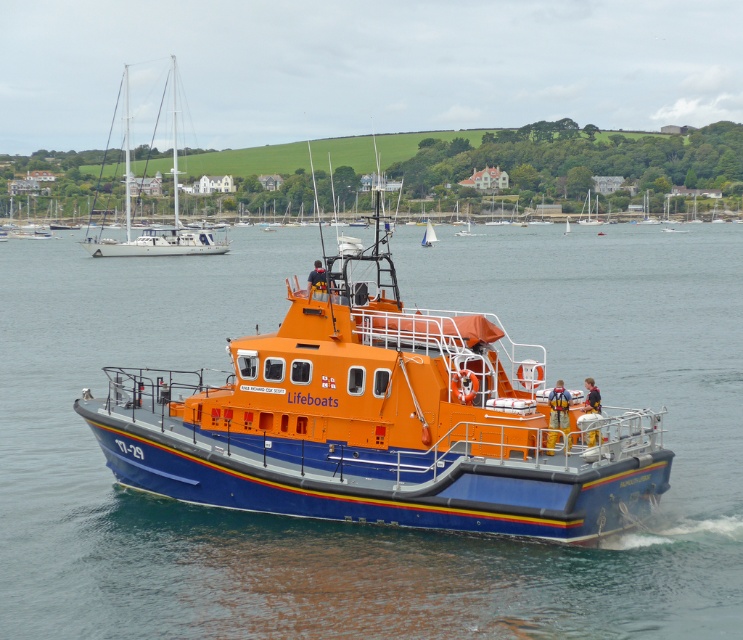
Question: Among these points, which one is nearest to the camera?

Choices:
 (A) (210, 248)
 (B) (100, 579)
 (C) (588, 193)

Answer: (B)

Question: Where is blue water at center located in relation to orange fiberglass sailboat at center in the image?

Choices:
 (A) below
 (B) above

Answer: (A)

Question: Among these points, which one is nearest to the camera?

Choices:
 (A) (594, 224)
 (B) (426, 221)
 (C) (45, 224)
 (D) (152, 243)

Answer: (D)

Question: Is orange matte lifeboat at center below orange fiberglass sailboat at center?

Choices:
 (A) yes
 (B) no

Answer: (A)

Question: Does orange matte lifeboat at upper center have a lesser width compared to orange matte lifeboat at center?

Choices:
 (A) no
 (B) yes

Answer: (A)

Question: Which point is closer to the camera?

Choices:
 (A) orange matte lifeboat at center
 (B) blue water at center
 (C) orange matte sailboat at upper left

Answer: (B)